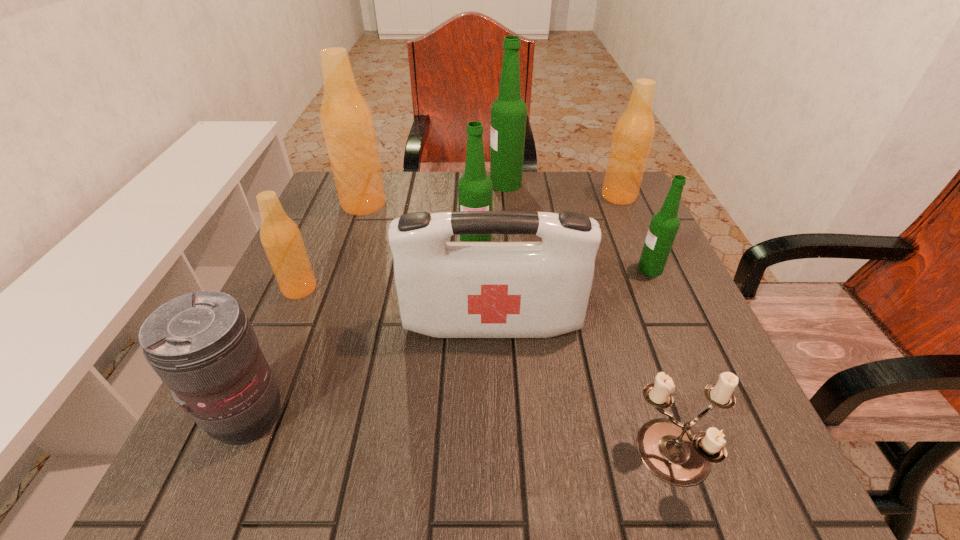
Image resolution: width=960 pixels, height=540 pixels. Identify the location of object at the far left corner. (347, 123).

This screenshot has width=960, height=540. In order to click on object that is at the near left corner in this screenshot , I will do `click(202, 345)`.

Locate an element on the screen. This screenshot has height=540, width=960. object that is at the far right corner is located at coordinates (633, 134).

I want to click on object located at the near right corner, so click(x=672, y=451).

In the image, there is a desktop. Where is `blank space at the far edge`? blank space at the far edge is located at coordinates (392, 175).

Locate an element on the screen. This screenshot has height=540, width=960. free space at the near edge of the desktop is located at coordinates click(297, 475).

In the image, there is a desktop. Where is `free space at the left edge`? free space at the left edge is located at coordinates (280, 344).

You are a GUI agent. You are given a task and a screenshot of the screen. Output one action in this format:
    pyautogui.click(x=<x>, y=<y>)
    Task: Click on the vacant space at the right edge of the desktop
    The height and width of the screenshot is (540, 960).
    Given the screenshot: What is the action you would take?
    pyautogui.click(x=613, y=269)

The width and height of the screenshot is (960, 540). I want to click on blank area at the far left corner, so click(331, 214).

Where is `free space at the near left corner`? This screenshot has height=540, width=960. free space at the near left corner is located at coordinates (220, 466).